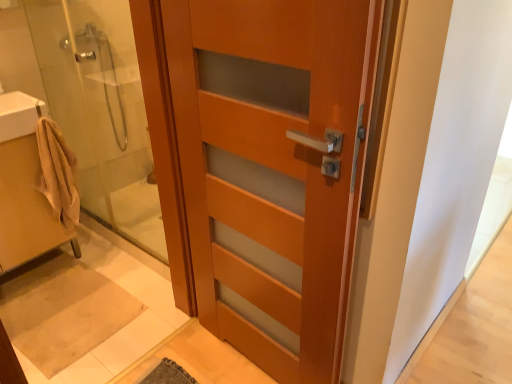
Question: Can you confirm if beige cotton bathrobe at left is thinner than matte wood door at center?

Choices:
 (A) no
 (B) yes

Answer: (B)

Question: Is beige cotton bathrobe at left closer to camera compared to matte wood door at center?

Choices:
 (A) no
 (B) yes

Answer: (A)

Question: Is beige cotton bathrobe at left oriented away from matte wood door at center?

Choices:
 (A) yes
 (B) no

Answer: (B)

Question: Can you confirm if beige cotton bathrobe at left is positioned to the left of matte wood door at center?

Choices:
 (A) yes
 (B) no

Answer: (A)

Question: Is beige cotton bathrobe at left behind matte wood door at center?

Choices:
 (A) no
 (B) yes

Answer: (B)

Question: Does beige cotton bathrobe at left have a greater width compared to matte wood door at center?

Choices:
 (A) no
 (B) yes

Answer: (A)

Question: Is white glossy sink at upper left, which is the first sink in top-to-bottom order, facing away from beige fabric towel at left, which is the 2th sink in top-to-bottom order?

Choices:
 (A) no
 (B) yes

Answer: (A)

Question: From a real-world perspective, is white glossy sink at upper left, which is the first sink in top-to-bottom order, positioned under beige fabric towel at left, which is the 2th sink in top-to-bottom order, based on gravity?

Choices:
 (A) no
 (B) yes

Answer: (A)

Question: Can we say white glossy sink at upper left, which is the first sink in top-to-bottom order, lies outside beige fabric towel at left, which is the 2th sink in top-to-bottom order?

Choices:
 (A) no
 (B) yes

Answer: (B)

Question: Can you confirm if white glossy sink at upper left, which is the first sink in top-to-bottom order, is positioned to the right of beige fabric towel at left, which is the 2th sink in top-to-bottom order?

Choices:
 (A) no
 (B) yes

Answer: (B)

Question: Considering the relative positions of white glossy sink at upper left, which is the first sink in top-to-bottom order, and beige fabric towel at left, arranged as the first sink when ordered from the bottom, in the image provided, is white glossy sink at upper left, which is the first sink in top-to-bottom order, to the left of beige fabric towel at left, arranged as the first sink when ordered from the bottom, from the viewer's perspective?

Choices:
 (A) no
 (B) yes

Answer: (A)

Question: Could you tell me if white glossy sink at upper left, which is the first sink in top-to-bottom order, is turned towards beige fabric towel at left, arranged as the first sink when ordered from the bottom?

Choices:
 (A) no
 (B) yes

Answer: (A)

Question: Is matte wood door at center further to the viewer compared to beige fabric towel at left, which is the 2th sink in top-to-bottom order?

Choices:
 (A) no
 (B) yes

Answer: (A)